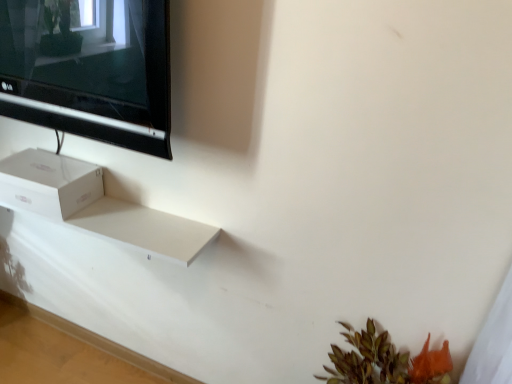
I want to click on free spot below black glossy tv at upper left (from a real-world perspective), so click(85, 359).